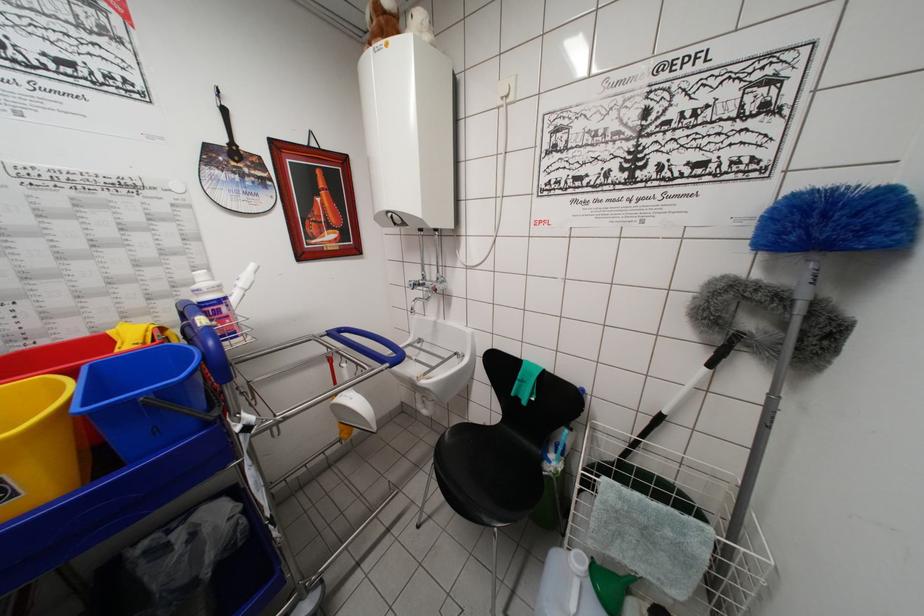
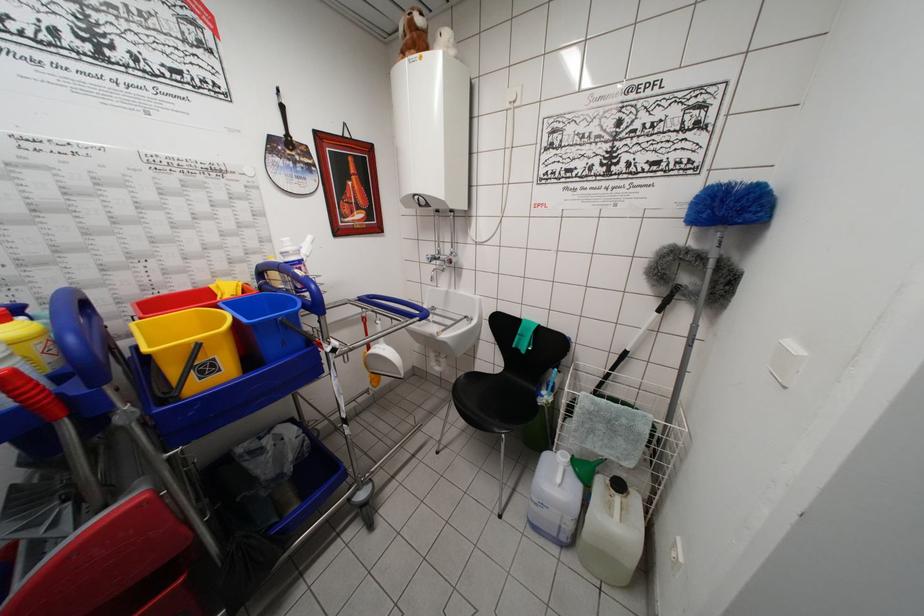
Locate, in the second image, the point that corresponds to (x=414, y=290) in the first image.

(432, 262)